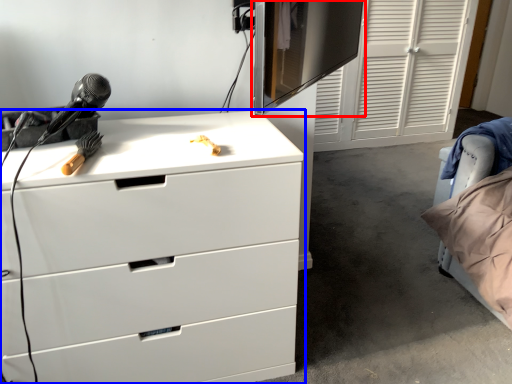
Question: Which object is closer to the camera taking this photo, computer monitor (highlighted by a red box) or chest of drawers (highlighted by a blue box)?

Choices:
 (A) computer monitor
 (B) chest of drawers

Answer: (A)